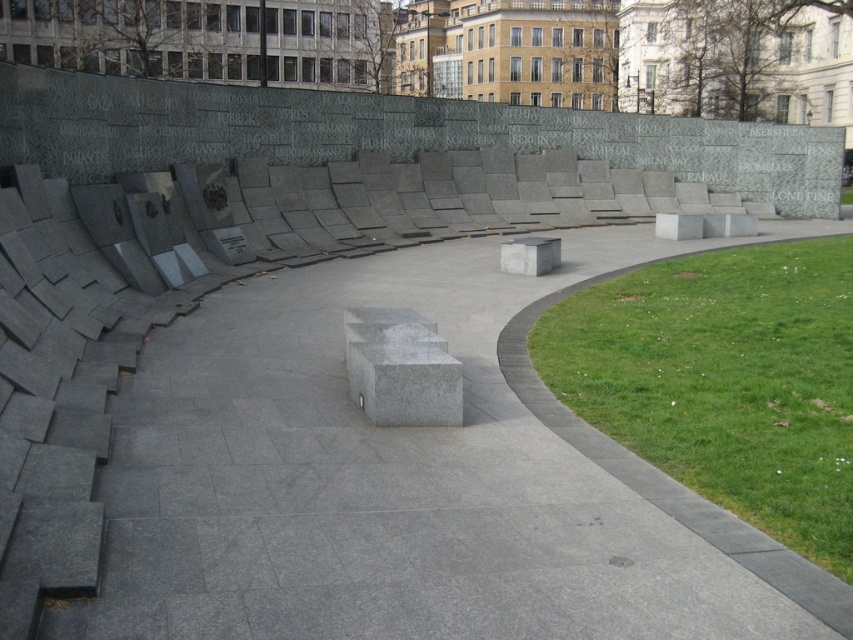
Question: Among these points, which one is farthest from the camera?

Choices:
 (A) (689, 264)
 (B) (173, 461)

Answer: (A)

Question: Is the position of gray concrete pavement at center less distant than that of green grass at lower right?

Choices:
 (A) no
 (B) yes

Answer: (B)

Question: From the image, what is the correct spatial relationship of gray concrete pavement at center in relation to green grass at lower right?

Choices:
 (A) left
 (B) right

Answer: (A)

Question: Does gray concrete pavement at center appear under green grass at lower right?

Choices:
 (A) yes
 (B) no

Answer: (A)